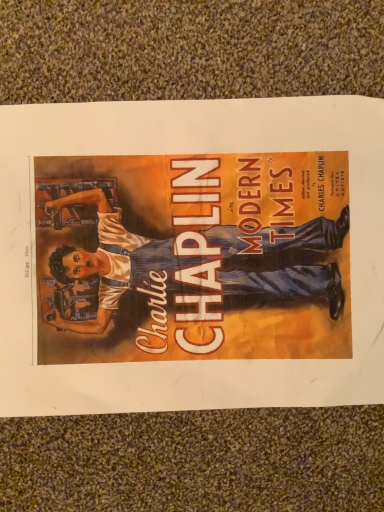
Measure the distance between matte blue overalls at center and camera.

matte blue overalls at center and camera are 11.14 inches apart from each other.

Locate an element on the screen. The width and height of the screenshot is (384, 512). matte blue overalls at center is located at coordinates (193, 253).

Describe the element at coordinates (193, 253) in the screenshot. I see `matte blue overalls at center` at that location.

What is the approximate width of matte blue overalls at center?

matte blue overalls at center is 31.20 centimeters wide.

The height and width of the screenshot is (512, 384). Identify the location of matte blue overalls at center. (193, 253).